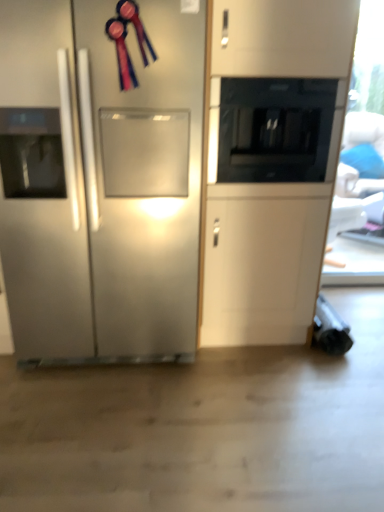
Question: Is black glass microwave at upper center thinner than stainless steel refrigerator at left?

Choices:
 (A) no
 (B) yes

Answer: (B)

Question: Is the surface of black glass microwave at upper center in direct contact with stainless steel refrigerator at left?

Choices:
 (A) no
 (B) yes

Answer: (A)

Question: Can we say black glass microwave at upper center lies outside stainless steel refrigerator at left?

Choices:
 (A) no
 (B) yes

Answer: (B)

Question: Can you confirm if black glass microwave at upper center is bigger than stainless steel refrigerator at left?

Choices:
 (A) no
 (B) yes

Answer: (A)

Question: Is black glass microwave at upper center positioned far away from stainless steel refrigerator at left?

Choices:
 (A) yes
 (B) no

Answer: (B)

Question: Is the depth of black glass microwave at upper center greater than that of stainless steel refrigerator at left?

Choices:
 (A) yes
 (B) no

Answer: (A)

Question: Is stainless steel refrigerator at left shorter than black glass microwave at upper center?

Choices:
 (A) yes
 (B) no

Answer: (B)

Question: Does stainless steel refrigerator at left have a smaller size compared to black glass microwave at upper center?

Choices:
 (A) no
 (B) yes

Answer: (A)

Question: Is stainless steel refrigerator at left outside of black glass microwave at upper center?

Choices:
 (A) yes
 (B) no

Answer: (A)

Question: From a real-world perspective, is stainless steel refrigerator at left beneath black glass microwave at upper center?

Choices:
 (A) no
 (B) yes

Answer: (B)

Question: Considering the relative sizes of stainless steel refrigerator at left and black glass microwave at upper center in the image provided, is stainless steel refrigerator at left taller than black glass microwave at upper center?

Choices:
 (A) yes
 (B) no

Answer: (A)

Question: Is stainless steel refrigerator at left bigger than black glass microwave at upper center?

Choices:
 (A) yes
 (B) no

Answer: (A)

Question: Is black glass microwave at upper center to the left or to the right of stainless steel refrigerator at left in the image?

Choices:
 (A) right
 (B) left

Answer: (A)